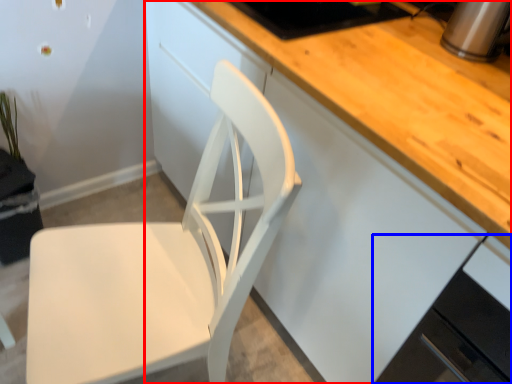
Question: Which object is closer to the camera taking this photo, cabinetry (highlighted by a red box) or cabinetry (highlighted by a blue box)?

Choices:
 (A) cabinetry
 (B) cabinetry

Answer: (B)